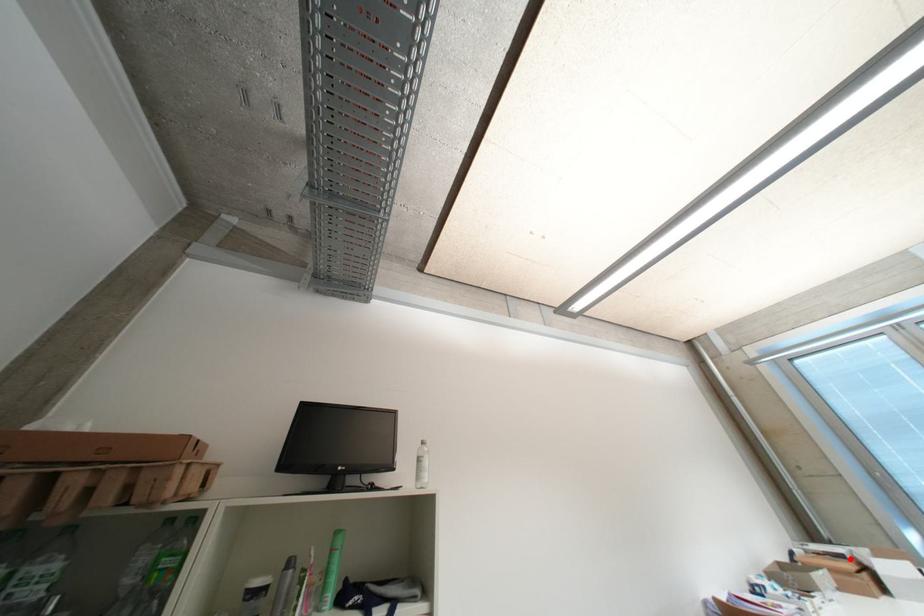
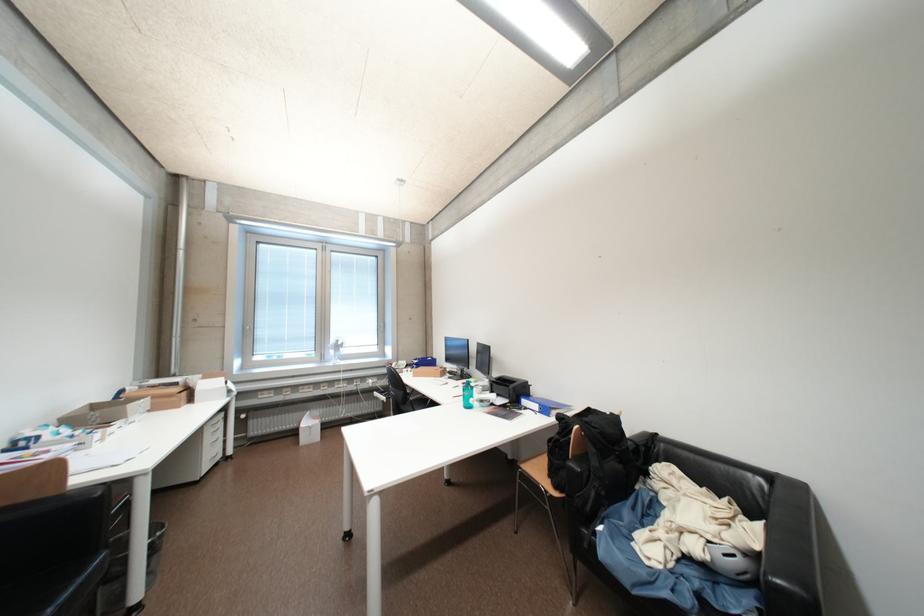
Where in the second image is the point corresponding to the highlighted location from the first image?

(184, 386)